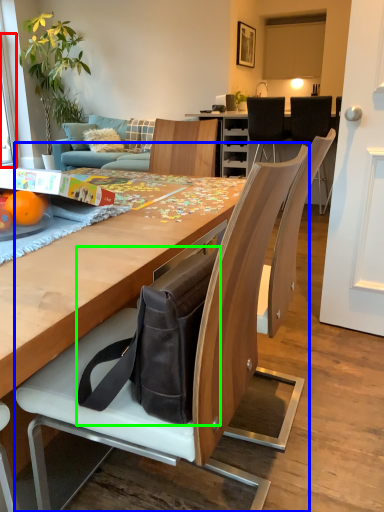
Question: Which is farther away from window screen (highlighted by a red box)? chair (highlighted by a blue box) or messenger bag (highlighted by a green box)?

Choices:
 (A) chair
 (B) messenger bag

Answer: (B)